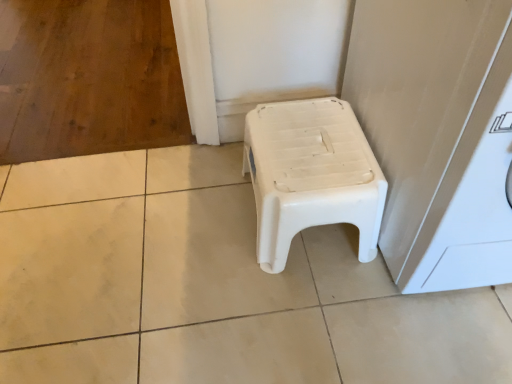
Find the location of a particular element. The height and width of the screenshot is (384, 512). white plastic washing machine at right is located at coordinates (471, 198).

Describe the element at coordinates (471, 198) in the screenshot. The width and height of the screenshot is (512, 384). I see `white plastic washing machine at right` at that location.

The width and height of the screenshot is (512, 384). I want to click on white plastic stool at center, so click(x=311, y=175).

What do you see at coordinates (311, 175) in the screenshot?
I see `white plastic stool at center` at bounding box center [311, 175].

At what (x,y) coordinates should I click in order to perform the action: click on white plastic washing machine at right. Please return your answer as a coordinate pair (x, y). The height and width of the screenshot is (384, 512). Looking at the image, I should click on (471, 198).

Looking at this image, is white plastic washing machine at right at the right side of white plastic stool at center?

Yes, white plastic washing machine at right is to the right of white plastic stool at center.

Does white plastic washing machine at right lie behind white plastic stool at center?

No, white plastic washing machine at right is closer to the viewer.

Which is in front, point (411, 292) or point (330, 129)?

The point (411, 292) is more forward.

From the image's perspective, relative to white plastic stool at center, is white plastic washing machine at right above or below?

white plastic washing machine at right is above white plastic stool at center.

From a real-world perspective, which object rests below the other?

white plastic stool at center is physically lower.

Between white plastic washing machine at right and white plastic stool at center, which one has larger width?

With larger width is white plastic washing machine at right.

In terms of height, does white plastic washing machine at right look taller or shorter compared to white plastic stool at center?

In the image, white plastic washing machine at right appears to be taller than white plastic stool at center.

Considering the sizes of white plastic washing machine at right and white plastic stool at center in the image, is white plastic washing machine at right bigger or smaller than white plastic stool at center?

Considering their sizes, white plastic washing machine at right takes up more space than white plastic stool at center.

Is white plastic washing machine at right inside the boundaries of white plastic stool at center, or outside?

white plastic washing machine at right is outside white plastic stool at center.

Would you say white plastic washing machine at right is a long distance from white plastic stool at center?

white plastic washing machine at right is near white plastic stool at center, not far away.

Could you tell me if white plastic washing machine at right is turned towards white plastic stool at center?

No, white plastic washing machine at right is not oriented towards white plastic stool at center.

How far apart are white plastic washing machine at right and white plastic stool at center?

10.52 inches.

Where is `stool on the left of white plastic washing machine at right`? This screenshot has width=512, height=384. stool on the left of white plastic washing machine at right is located at coordinates (311, 175).

Which object is positioned more to the left, white plastic stool at center or white plastic washing machine at right?

white plastic stool at center.

Is white plastic stool at center closer to camera compared to white plastic washing machine at right?

No.

Is point (357, 143) closer or farther from the camera than point (505, 74)?

Point (357, 143).

From the image's perspective, which is above, white plastic stool at center or white plastic washing machine at right?

white plastic washing machine at right.

From a real-world perspective, which is physically below, white plastic stool at center or white plastic washing machine at right?

In real-world perspective, white plastic stool at center is lower.

Which of these two, white plastic stool at center or white plastic washing machine at right, is wider?

With larger width is white plastic washing machine at right.

Does white plastic stool at center have a greater height compared to white plastic washing machine at right?

Incorrect, the height of white plastic stool at center is not larger of that of white plastic washing machine at right.

Is white plastic stool at center bigger than white plastic washing machine at right?

Incorrect, white plastic stool at center is not larger than white plastic washing machine at right.

Is white plastic stool at center not within white plastic washing machine at right?

Indeed, white plastic stool at center is completely outside white plastic washing machine at right.

Is white plastic stool at center next to white plastic washing machine at right and touching it?

No, white plastic stool at center is not beside white plastic washing machine at right.

Could you tell me if white plastic stool at center is facing white plastic washing machine at right?

No.

What's the angular difference between white plastic stool at center and white plastic washing machine at right's facing directions?

→ The facing directions of white plastic stool at center and white plastic washing machine at right are 0.81 degrees apart.

Image resolution: width=512 pixels, height=384 pixels. I want to click on stool behind the white plastic washing machine at right, so click(311, 175).

Locate an element on the screen. Image resolution: width=512 pixels, height=384 pixels. stool below the white plastic washing machine at right (from a real-world perspective) is located at coordinates (311, 175).

You are a GUI agent. You are given a task and a screenshot of the screen. Output one action in this format:
    pyautogui.click(x=<x>, y=<y>)
    Task: Click on the washing machine above the white plastic stool at center (from the image's perspective)
    
    Given the screenshot: What is the action you would take?
    pyautogui.click(x=471, y=198)